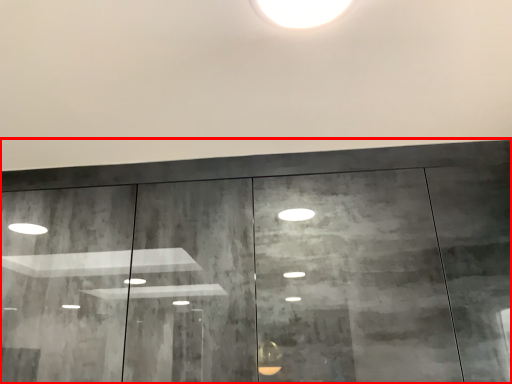
Question: From the image's perspective, what is the correct spatial relationship of door (annotated by the red box) in relation to light?

Choices:
 (A) above
 (B) below

Answer: (B)